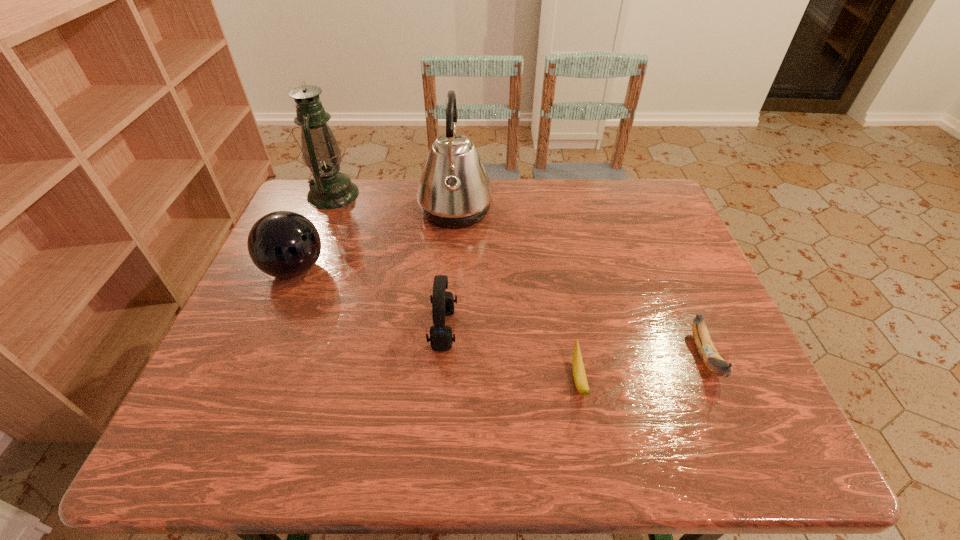
The image size is (960, 540). In the image, there is a desktop. In order to click on vacant space at the far edge in this screenshot , I will do `click(492, 207)`.

The height and width of the screenshot is (540, 960). Identify the location of free space at the near edge. (610, 446).

Find the location of a particular element. The height and width of the screenshot is (540, 960). free space at the left edge is located at coordinates (220, 394).

In order to click on vacant space at the right edge of the desktop in this screenshot , I will do `click(679, 288)`.

This screenshot has width=960, height=540. In order to click on vacant space at the near left corner of the desktop in this screenshot , I will do `click(199, 435)`.

What are the coordinates of `free space at the far right corner of the desktop` in the screenshot? It's located at (633, 212).

At what (x,y) coordinates should I click in order to perform the action: click on free spot between the oil lamp and the kettle. Please return your answer as a coordinate pair (x, y). Image resolution: width=960 pixels, height=540 pixels. Looking at the image, I should click on (395, 203).

You are a GUI agent. You are given a task and a screenshot of the screen. Output one action in this format:
    pyautogui.click(x=<x>, y=<y>)
    Task: Click on the free spot between the bowling ball and the taller banana
    The image size is (960, 540).
    Given the screenshot: What is the action you would take?
    pyautogui.click(x=500, y=313)

Where is `free area in between the third shortest object and the kettle`? Image resolution: width=960 pixels, height=540 pixels. free area in between the third shortest object and the kettle is located at coordinates (449, 271).

This screenshot has width=960, height=540. Identify the location of empty space between the taller banana and the shorter banana. (642, 368).